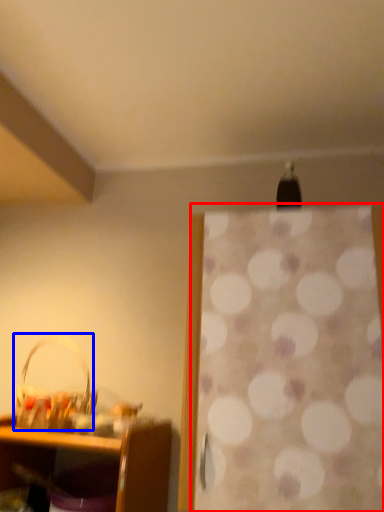
Question: Which object is further to the camera taking this photo, curtain (highlighted by a red box) or basket (highlighted by a blue box)?

Choices:
 (A) curtain
 (B) basket

Answer: (B)